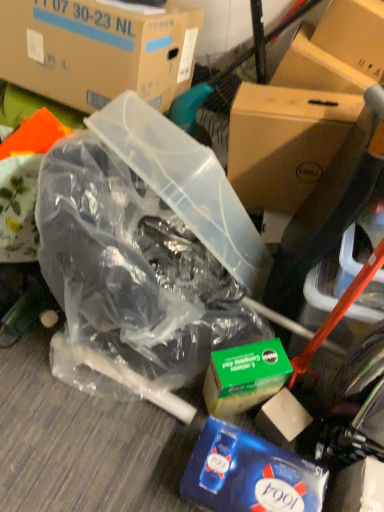
Question: Would you say transparent plastic bag at center contains blue glossy tissue box at lower right?

Choices:
 (A) yes
 (B) no

Answer: (B)

Question: From the image's perspective, is transparent plastic bag at center over blue glossy tissue box at lower right?

Choices:
 (A) yes
 (B) no

Answer: (A)

Question: Can you confirm if transparent plastic bag at center is positioned to the right of blue glossy tissue box at lower right?

Choices:
 (A) yes
 (B) no

Answer: (B)

Question: Is the depth of transparent plastic bag at center greater than that of blue glossy tissue box at lower right?

Choices:
 (A) yes
 (B) no

Answer: (B)

Question: From a real-world perspective, is transparent plastic bag at center on blue glossy tissue box at lower right?

Choices:
 (A) yes
 (B) no

Answer: (A)

Question: Is blue glossy tissue box at lower right taller or shorter than transparent plastic bag at center?

Choices:
 (A) tall
 (B) short

Answer: (B)

Question: In the image, is blue glossy tissue box at lower right positioned in front of or behind transparent plastic bag at center?

Choices:
 (A) front
 (B) behind

Answer: (B)

Question: From the image's perspective, is blue glossy tissue box at lower right located above or below transparent plastic bag at center?

Choices:
 (A) above
 (B) below

Answer: (B)

Question: From a real-world perspective, relative to transparent plastic bag at center, is blue glossy tissue box at lower right vertically above or below?

Choices:
 (A) above
 (B) below

Answer: (B)

Question: From the image's perspective, is cardboard box at upper left, which is the first box in left-to-right order, above or below transparent plastic bag at center?

Choices:
 (A) above
 (B) below

Answer: (A)

Question: Is cardboard box at upper left, marked as the second box in a right-to-left arrangement, to the left or to the right of transparent plastic bag at center in the image?

Choices:
 (A) left
 (B) right

Answer: (A)

Question: Considering their positions, is cardboard box at upper left, marked as the second box in a right-to-left arrangement, located in front of or behind transparent plastic bag at center?

Choices:
 (A) behind
 (B) front

Answer: (A)

Question: Looking at their shapes, would you say cardboard box at upper left, marked as the second box in a right-to-left arrangement, is wider or thinner than transparent plastic bag at center?

Choices:
 (A) wide
 (B) thin

Answer: (B)

Question: Is transparent plastic bag at center bigger or smaller than cardboard box at upper left, marked as the second box in a right-to-left arrangement?

Choices:
 (A) small
 (B) big

Answer: (B)

Question: Is transparent plastic bag at center wider or thinner than cardboard box at upper left, marked as the second box in a right-to-left arrangement?

Choices:
 (A) thin
 (B) wide

Answer: (B)